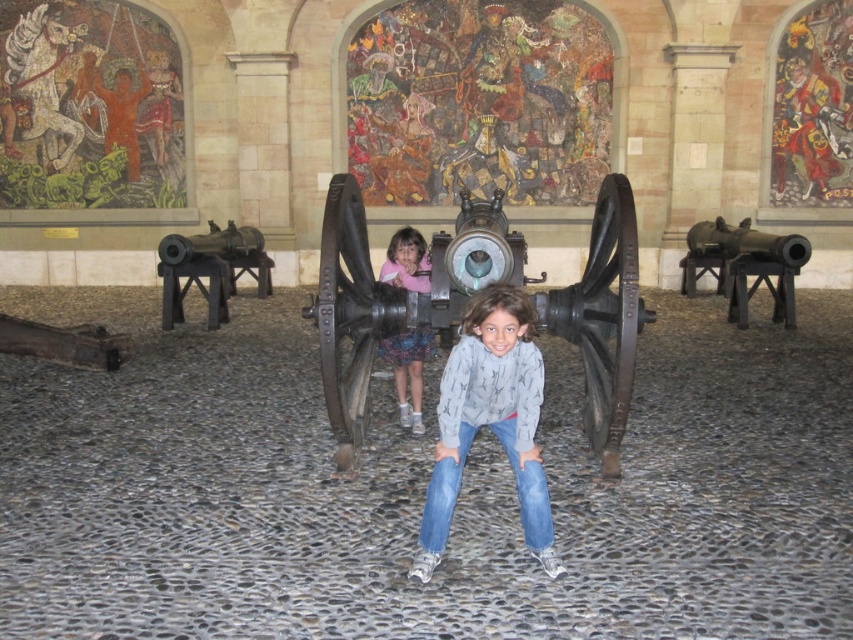
You are a photographer trying to capture a clear shot of the pink fabric dress at center and the polished bronze cannon at right. However, the cannon is blocking your view. Can you move the cannon to the side to get a better angle? Explain why or why not based on the scene description.

The pink fabric dress at center is behind the polished bronze cannon at right, meaning the cannon is in front of the dress. Since the cannon is a large, antique object, it is likely immovable, so you cannot move it to the side to get a better angle.

You are a costume designer preparing for a play. You have two options for a character costume in the play. The gray cotton hoodie at center and the pink fabric dress at center. The director wants the costume to be as wide as possible. Which one should you choose?

The gray cotton hoodie at center has a greater width than the pink fabric dress at center, so you should choose the gray cotton hoodie at center for the widest option.